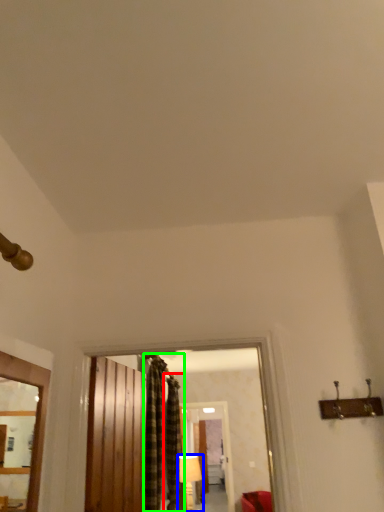
Question: Based on their relative distances, which object is farther from curtain (highlighted by a red box)? Choose from lamp (highlighted by a blue box) and curtain (highlighted by a green box).

Choices:
 (A) lamp
 (B) curtain

Answer: (A)